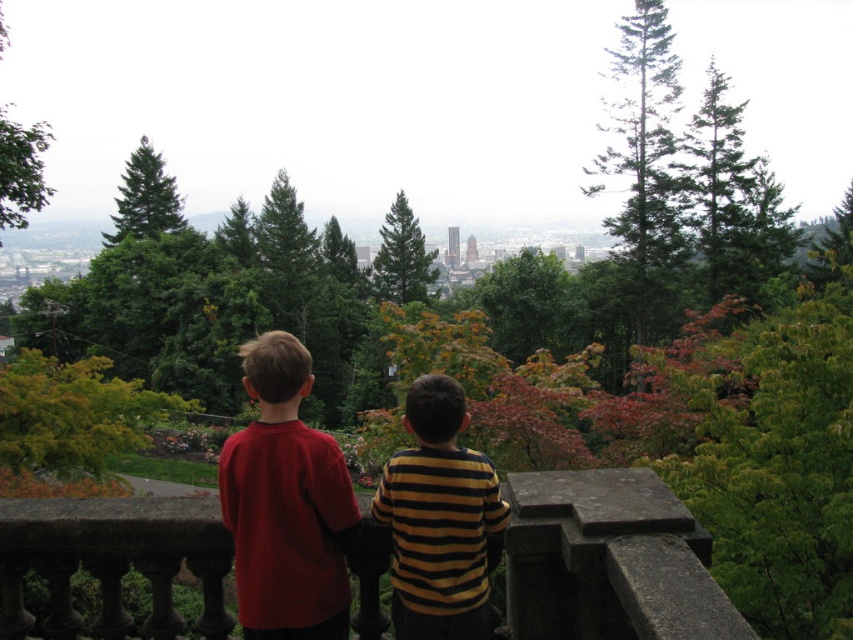
Question: Which point is farther from the camera taking this photo?

Choices:
 (A) (x=160, y=204)
 (B) (x=642, y=296)

Answer: (A)

Question: Does striped cotton shirt at center appear over green leafy tree at upper left?

Choices:
 (A) yes
 (B) no

Answer: (B)

Question: Among these objects, which one is nearest to the camera?

Choices:
 (A) matte red shirt at center
 (B) striped cotton shirt at center

Answer: (A)

Question: Is green matte tree at upper left positioned at the back of green matte tree at center?

Choices:
 (A) yes
 (B) no

Answer: (A)

Question: Which point is farther from the camera taking this photo?

Choices:
 (A) (21, 170)
 (B) (416, 275)

Answer: (B)

Question: Is green textured pine tree at upper center thinner than green matte tree at upper left?

Choices:
 (A) no
 (B) yes

Answer: (B)